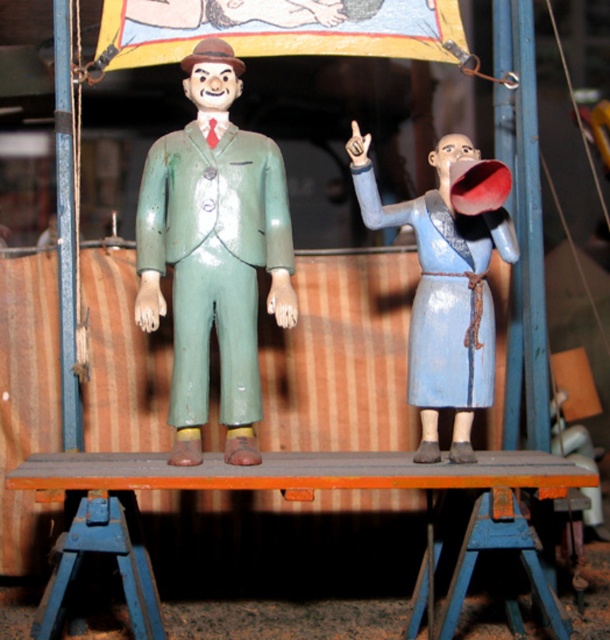
In the scene shown: Does green painted wood figure at center appear under blue matte megaphone at right?

Incorrect, green painted wood figure at center is not positioned below blue matte megaphone at right.

The image size is (610, 640). What are the coordinates of `green painted wood figure at center` in the screenshot? It's located at (214, 253).

Does point (167, 250) lie in front of point (465, 385)?

That is False.

You are a GUI agent. You are given a task and a screenshot of the screen. Output one action in this format:
    pyautogui.click(x=<x>, y=<y>)
    Task: Click on the green painted wood figure at center
    
    Given the screenshot: What is the action you would take?
    pyautogui.click(x=214, y=253)